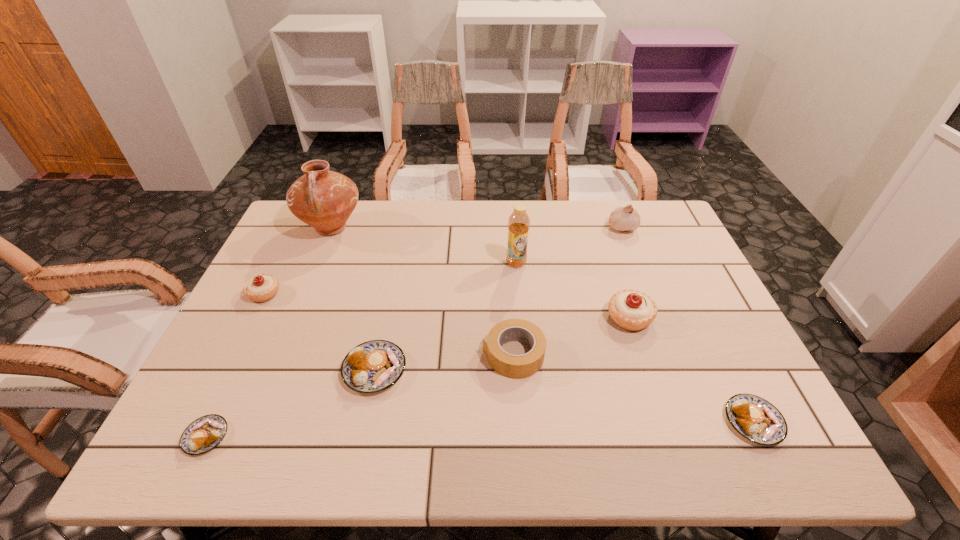
The image size is (960, 540). What are the coordinates of `object present at the far left corner` in the screenshot? It's located at (323, 199).

At what (x,y) coordinates should I click in order to perform the action: click on object situated at the near left corner. Please return your answer as a coordinate pair (x, y). The image size is (960, 540). Looking at the image, I should click on (201, 436).

Locate an element on the screen. object at the far right corner is located at coordinates (622, 218).

This screenshot has width=960, height=540. I want to click on object that is at the near right corner, so click(x=756, y=419).

Identify the location of free region at the far edge of the desktop. The height and width of the screenshot is (540, 960). (352, 238).

You are a GUI agent. You are given a task and a screenshot of the screen. Output one action in this format:
    pyautogui.click(x=<x>, y=<y>)
    Task: Click on the vacant region at the near edge
    
    Given the screenshot: What is the action you would take?
    click(310, 443)

In order to click on free location at the left edge of the desktop in this screenshot , I will do `click(286, 284)`.

Find the location of a particular element. vacant space at the right edge is located at coordinates 671,255.

Identify the location of vacant space at the near left corner of the desktop. The width and height of the screenshot is (960, 540). (165, 459).

Identify the location of vacant space at the far right corner of the desktop. (651, 241).